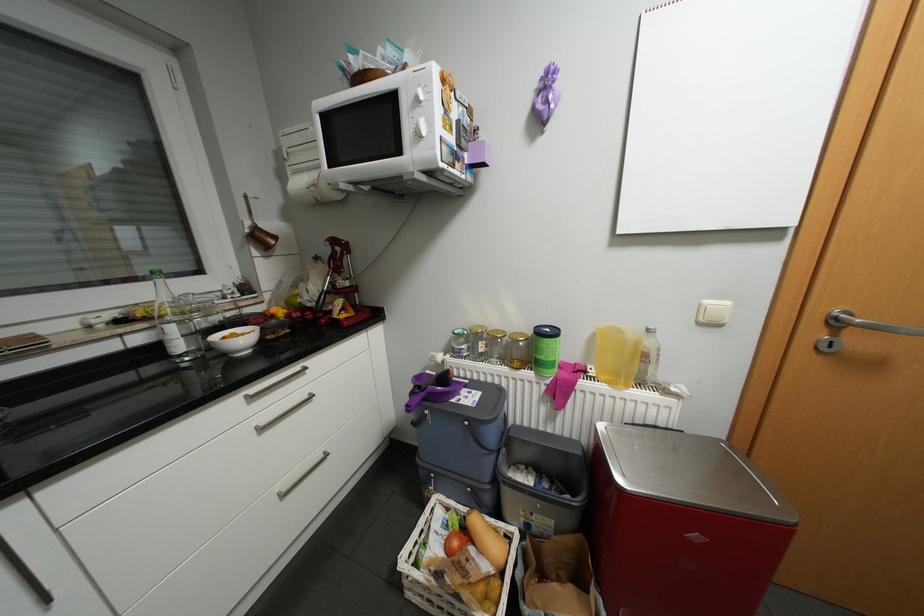
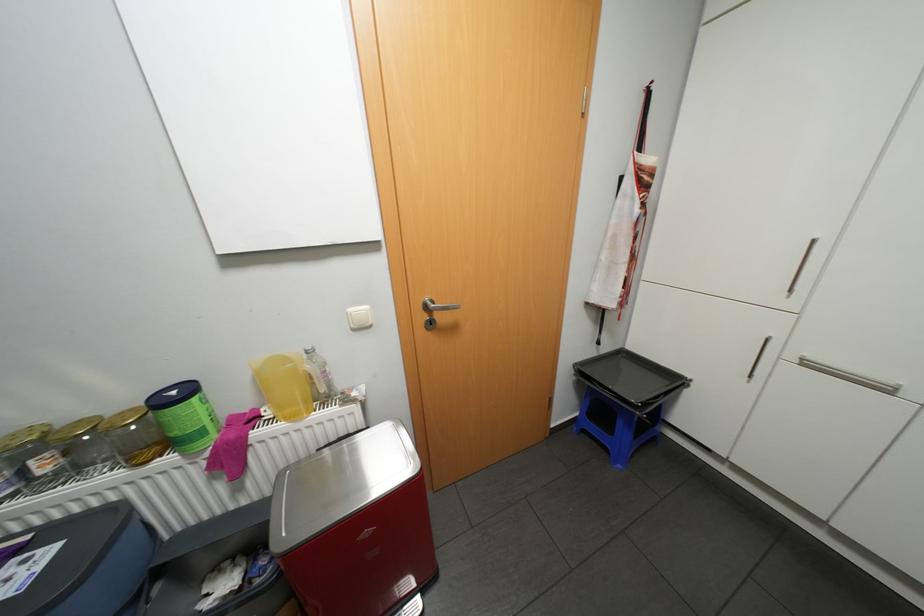
The point at (600, 371) is marked in the first image. Where is the corresponding point in the second image?

(275, 413)